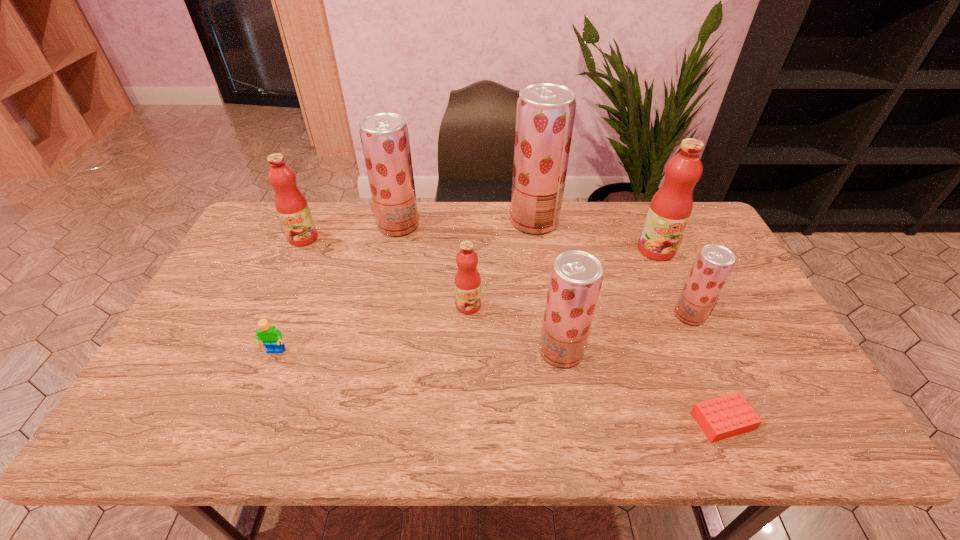
Locate an element on the screen. Image resolution: width=960 pixels, height=540 pixels. the smallest strawberry fruit juice is located at coordinates (714, 263).

Identify the location of the nearest pink fruit juice. (467, 279).

At what (x,y) coordinates should I click in order to perform the action: click on the smallest pink fruit juice. Please return your answer as a coordinate pair (x, y). The height and width of the screenshot is (540, 960). Looking at the image, I should click on (467, 279).

Image resolution: width=960 pixels, height=540 pixels. I want to click on the farther Lego, so click(x=271, y=337).

Locate an element on the screen. The height and width of the screenshot is (540, 960). the left Lego is located at coordinates (271, 337).

The image size is (960, 540). Find the location of `the nearest object`. the nearest object is located at coordinates (730, 415).

Identify the location of the shortest object. (730, 415).

I want to click on vacant point located 0.150m on the right of the biggest strawberry fruit juice, so click(602, 221).

At what (x,y) coordinates should I click in order to perform the action: click on vacant space located on the front label of the rightmost pink fruit juice. Please return your answer as a coordinate pair (x, y). This screenshot has width=960, height=540. Looking at the image, I should click on (682, 307).

You are a GUI agent. You are given a task and a screenshot of the screen. Output one action in this format:
    pyautogui.click(x=<x>, y=<y>)
    Task: Click on the vacant space located on the right of the leftmost strawberry fruit juice
    
    Given the screenshot: What is the action you would take?
    pyautogui.click(x=448, y=225)